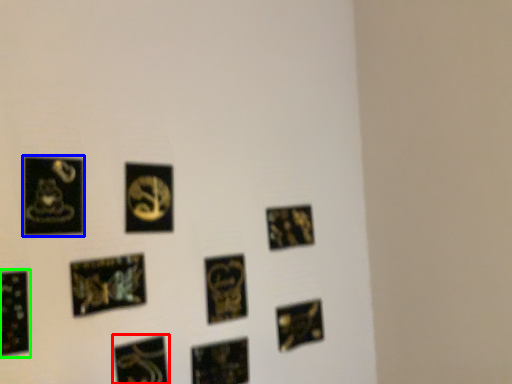
Question: Which is farther away from picture frame (highlighted by a red box)? picture frame (highlighted by a blue box) or picture frame (highlighted by a green box)?

Choices:
 (A) picture frame
 (B) picture frame

Answer: (A)